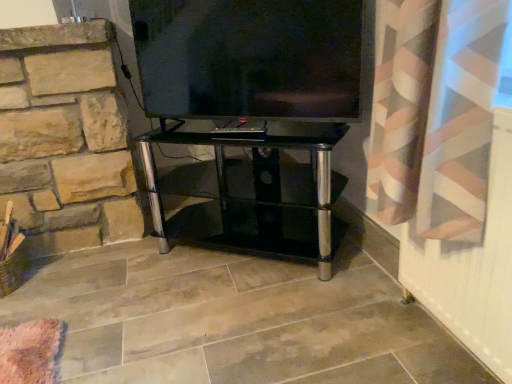
Question: Is flat screen tv at center taller or shorter than black glass tv stand at center?

Choices:
 (A) tall
 (B) short

Answer: (B)

Question: In the image, is flat screen tv at center positioned in front of or behind black glass tv stand at center?

Choices:
 (A) front
 (B) behind

Answer: (A)

Question: From the image's perspective, relative to black glass tv stand at center, is flat screen tv at center above or below?

Choices:
 (A) below
 (B) above

Answer: (B)

Question: Is point (143, 152) closer or farther from the camera than point (340, 102)?

Choices:
 (A) farther
 (B) closer

Answer: (A)

Question: Is black glass tv stand at center in front of or behind flat screen tv at center in the image?

Choices:
 (A) behind
 (B) front

Answer: (A)

Question: Visually, is black glass tv stand at center positioned to the left or to the right of flat screen tv at center?

Choices:
 (A) left
 (B) right

Answer: (A)

Question: Considering the positions of black glass tv stand at center and flat screen tv at center in the image, is black glass tv stand at center taller or shorter than flat screen tv at center?

Choices:
 (A) short
 (B) tall

Answer: (B)